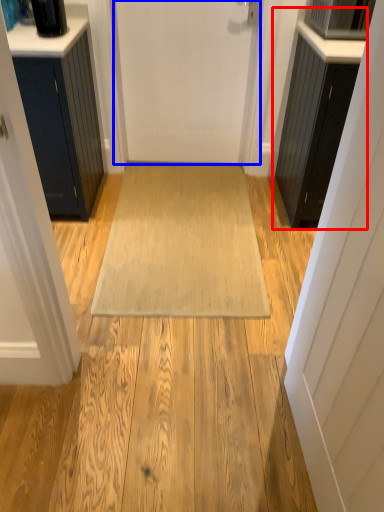
Question: Among these objects, which one is nearest to the camera, cabinetry (highlighted by a red box) or door (highlighted by a blue box)?

Choices:
 (A) cabinetry
 (B) door

Answer: (A)